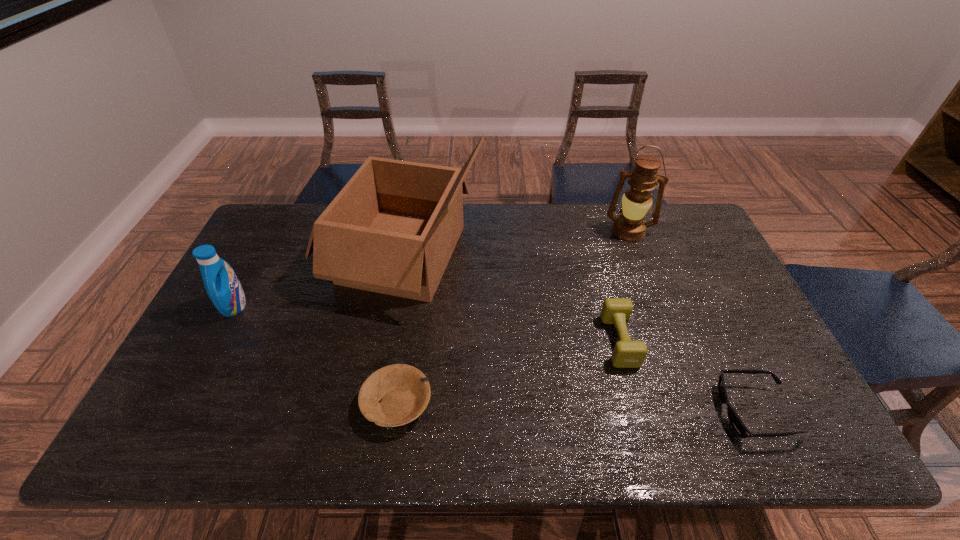
The height and width of the screenshot is (540, 960). I want to click on box, so click(x=392, y=229).

Find the location of a particular element. oil lamp is located at coordinates (630, 226).

Image resolution: width=960 pixels, height=540 pixels. I want to click on the leftmost object, so click(x=223, y=287).

You are a GUI agent. You are given a task and a screenshot of the screen. Output one action in this format:
    pyautogui.click(x=<x>, y=<y>)
    Task: Click on the detergent
    The height and width of the screenshot is (540, 960).
    Given the screenshot: What is the action you would take?
    pyautogui.click(x=223, y=287)

Locate an element on the screen. This screenshot has height=540, width=960. dumbbell is located at coordinates (627, 354).

Find the location of a particular element. the fourth tallest object is located at coordinates (627, 354).

Image resolution: width=960 pixels, height=540 pixels. I want to click on sunglasses, so click(x=738, y=426).

The image size is (960, 540). What are the coordinates of `bowl` in the screenshot? It's located at (403, 391).

Find the location of a particular element. The image size is (960, 540). free space located 0.120m on the front of the box is located at coordinates (385, 356).

This screenshot has height=540, width=960. I want to click on free space located 0.340m on the left of the oil lamp, so click(506, 232).